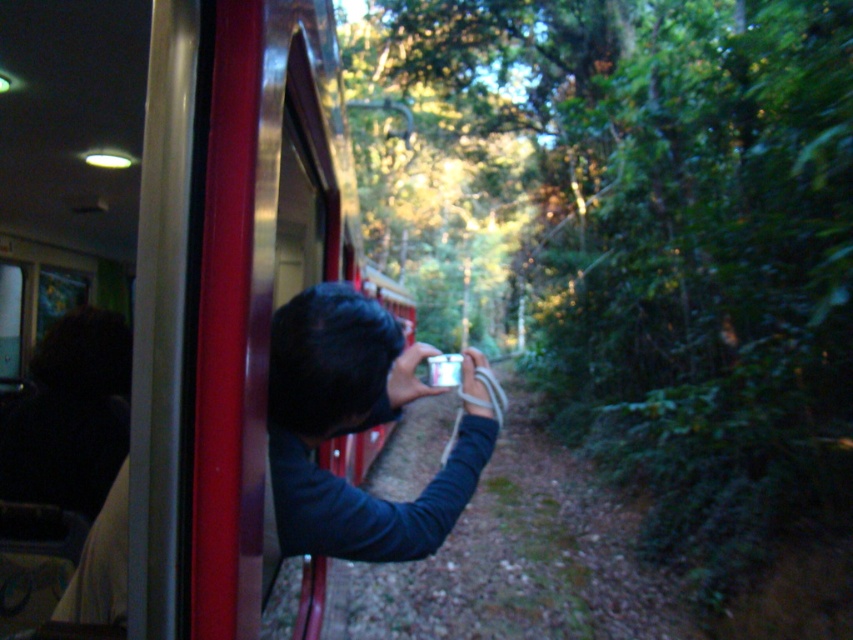
Is point (175, 605) in front of point (328, 289)?

Yes, point (175, 605) is in front of point (328, 289).

How much distance is there between metallic red train at left and metallic silver camera at center?

A distance of 3.66 meters exists between metallic red train at left and metallic silver camera at center.

This screenshot has width=853, height=640. What do you see at coordinates (210, 280) in the screenshot? I see `metallic red train at left` at bounding box center [210, 280].

Locate an element on the screen. metallic red train at left is located at coordinates (210, 280).